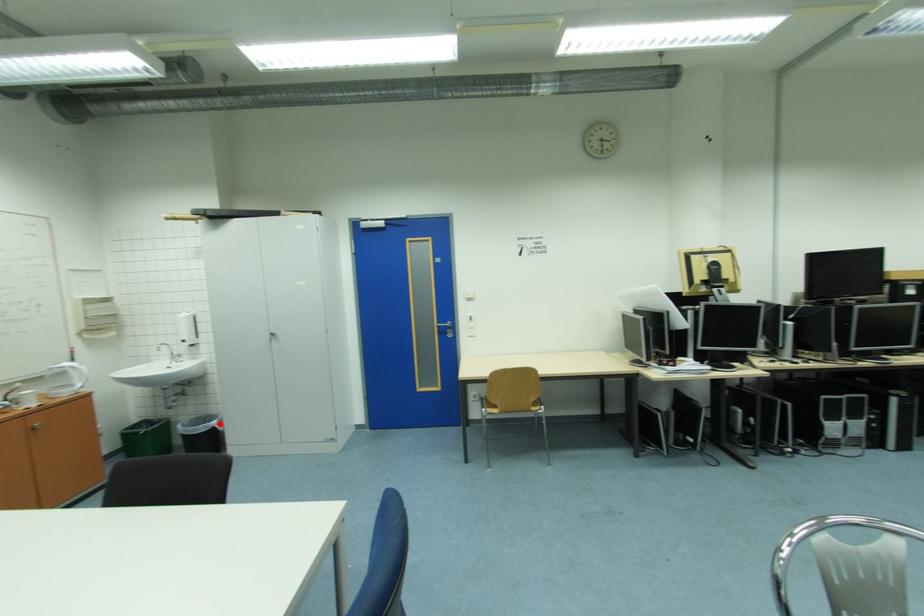
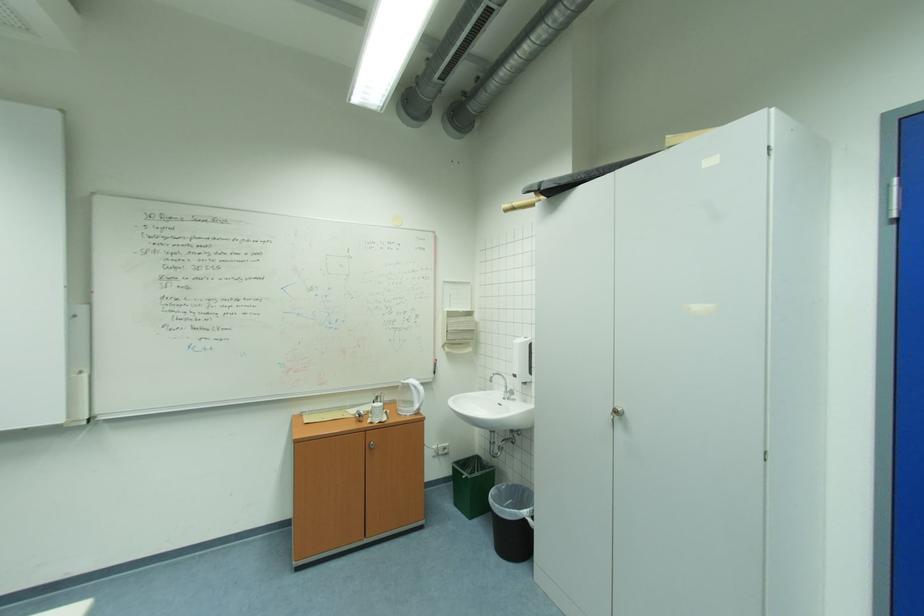
Question: A red point is marked in image1. In image2, is the corresponding 3D point closer to the camera or farther? Reply with the corresponding letter.

Choices:
 (A) The corresponding 3D point is closer.
 (B) The corresponding 3D point is farther.

Answer: (B)